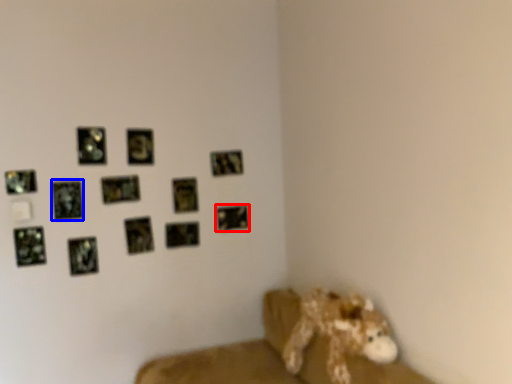
Question: Which of the following is the farthest to the observer, picture frame (highlighted by a red box) or picture frame (highlighted by a blue box)?

Choices:
 (A) picture frame
 (B) picture frame

Answer: (A)